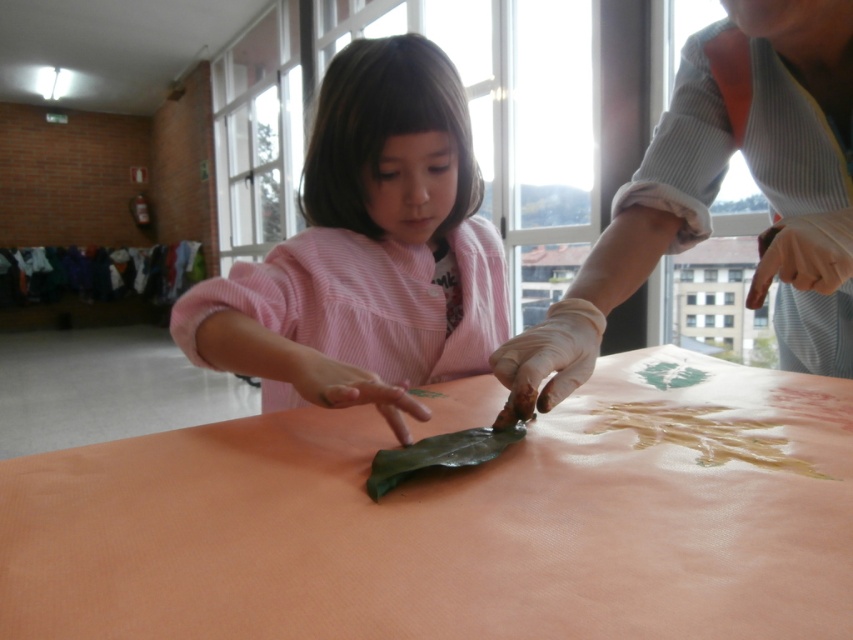
Question: In this image, where is orange matte table at center located relative to white rubber glove at upper right?

Choices:
 (A) below
 (B) above

Answer: (A)

Question: Which object appears closest to the camera in this image?

Choices:
 (A) white rubber glove at upper right
 (B) orange matte table at center

Answer: (B)

Question: Does orange matte table at center appear on the right side of green rubber leaf at center?

Choices:
 (A) no
 (B) yes

Answer: (B)

Question: Which of the following is the closest to the observer?

Choices:
 (A) orange matte table at center
 (B) white rubber glove at upper right

Answer: (A)

Question: Which object is the farthest from the pink striped sweater at center?

Choices:
 (A) white rubber glove at upper right
 (B) green rubber leaf at center
 (C) orange matte table at center

Answer: (B)

Question: Is orange matte table at center in front of pink striped sweater at center?

Choices:
 (A) yes
 (B) no

Answer: (A)